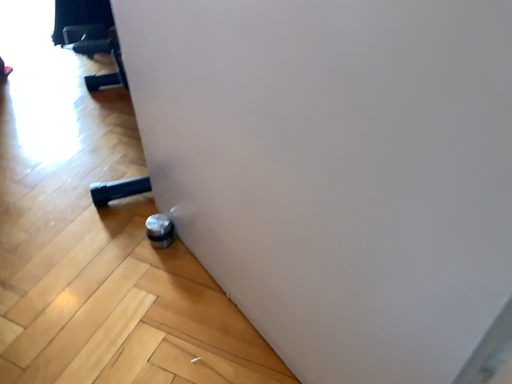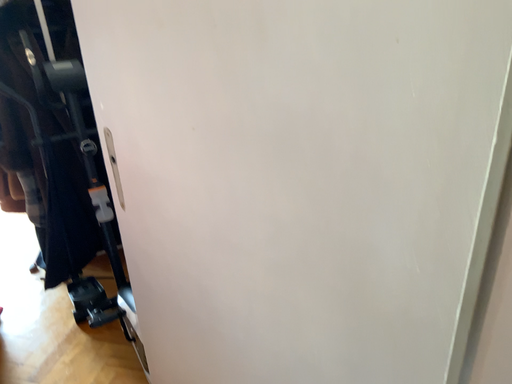
Question: Which way did the camera rotate in the video?

Choices:
 (A) rotated downward
 (B) rotated upward

Answer: (B)